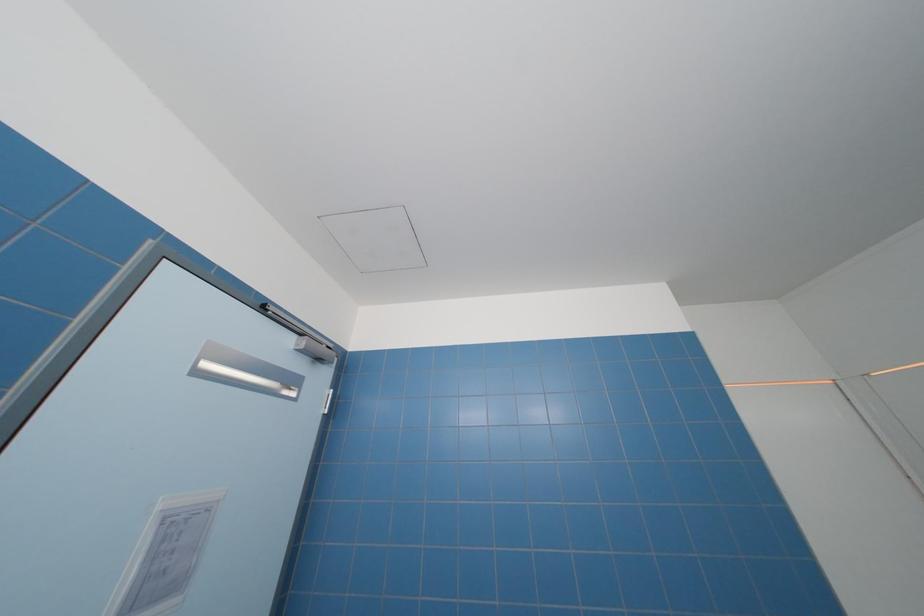
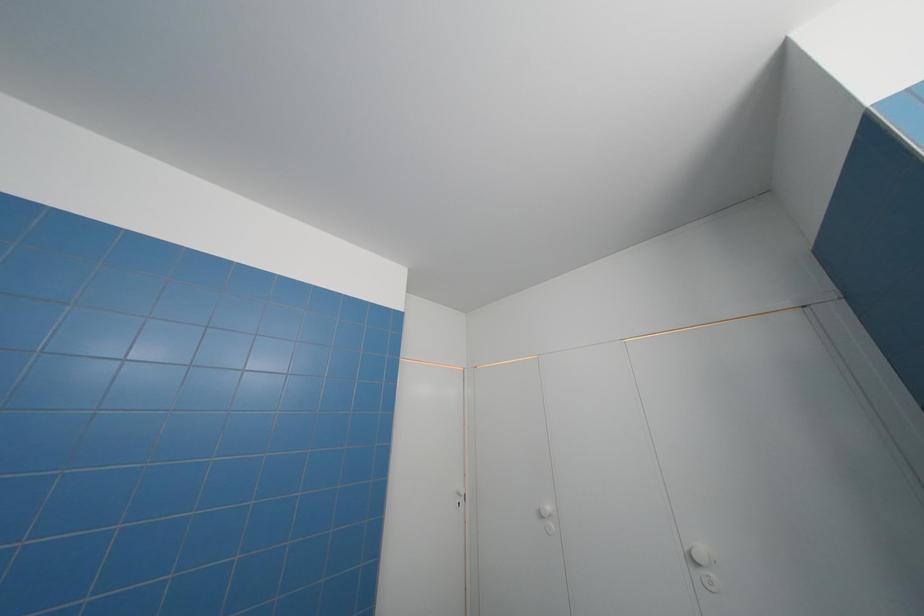
Question: Based on the continuous images, in which direction is the camera rotating? Reply with the corresponding letter.

Choices:
 (A) Left
 (B) Right
 (C) Up
 (D) Down

Answer: (B)